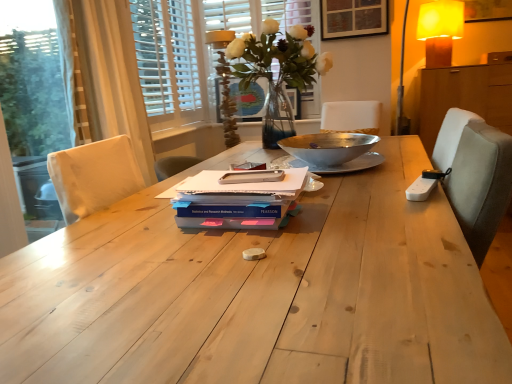
This screenshot has width=512, height=384. I want to click on metallic silver bowl at center, so click(x=328, y=147).

Measure the distance between matte glass vase at upper center, arranged as the first table lamp when viewed from the left, and camera.

matte glass vase at upper center, arranged as the first table lamp when viewed from the left, is 8.73 feet away from camera.

Describe the element at coordinates (225, 84) in the screenshot. I see `matte glass vase at upper center, positioned as the 1th table lamp in bottom-to-top order` at that location.

The width and height of the screenshot is (512, 384). Describe the element at coordinates (170, 60) in the screenshot. I see `clear glass vase at upper center, the 1th bay window viewed from the right` at that location.

Where is `pearlescent paper at center, the 2th paperback book from the top`? This screenshot has height=384, width=512. pearlescent paper at center, the 2th paperback book from the top is located at coordinates (237, 200).

Locate an element on the screen. The height and width of the screenshot is (384, 512). translucent glass vase at center is located at coordinates (279, 72).

Can you confirm if white wooden blinds at upper left, the first bay window in the left-to-right sequence, is shorter than metallic silver bowl at center?

No.

Where is `the 1st bay window behind the metallic silver bowl at center, counting from the anchor's position`? The width and height of the screenshot is (512, 384). the 1st bay window behind the metallic silver bowl at center, counting from the anchor's position is located at coordinates (168, 62).

Considering the relative positions of white wooden blinds at upper left, which is the 2th bay window in right-to-left order, and metallic silver bowl at center in the image provided, is white wooden blinds at upper left, which is the 2th bay window in right-to-left order, to the left of metallic silver bowl at center from the viewer's perspective?

Correct, you'll find white wooden blinds at upper left, which is the 2th bay window in right-to-left order, to the left of metallic silver bowl at center.

Can we say white wooden blinds at upper left, which is the 2th bay window in right-to-left order, lies outside metallic silver bowl at center?

Yes.

Is wooden picture frame at upper center further to camera compared to white matte notebook at center, the 3th paperback book positioned from the bottom?

Yes, it is behind white matte notebook at center, the 3th paperback book positioned from the bottom.

Is wooden picture frame at upper center looking in the opposite direction of white matte notebook at center, the 3th paperback book positioned from the bottom?

No.

The width and height of the screenshot is (512, 384). There is a white matte notebook at center, the 3th paperback book positioned from the bottom. Find the location of `picture frame above it (from a real-world perspective)`. picture frame above it (from a real-world perspective) is located at coordinates (353, 18).

From a real-world perspective, is wooden picture frame at upper center positioned over white matte notebook at center, positioned as the 1th paperback book in top-to-bottom order, based on gravity?

Yes.

Which table lamp is the 2nd one when counting from the back of the blue matte paperback book at center, which appears as the first paperback book when ordered from the bottom? Please provide its 2D coordinates.

[(440, 30)]

Considering the positions of points (450, 45) and (268, 210), is point (450, 45) closer to camera compared to point (268, 210)?

That is False.

Looking at this image, are yellow fabric lampshade at upper right, the 2th table lamp positioned from the left, and blue matte paperback book at center, the third paperback book viewed from the top, far apart?

That's right, there is a large distance between yellow fabric lampshade at upper right, the 2th table lamp positioned from the left, and blue matte paperback book at center, the third paperback book viewed from the top.

Who is shorter, natural wood table at center or white fabric curtain at left?

natural wood table at center.

Considering the points (77, 338) and (120, 130), which point is in front, point (77, 338) or point (120, 130)?

The point (77, 338) is closer to the camera.

Could you tell me if natural wood table at center is facing white fabric curtain at left?

No.

From the image's perspective, who appears lower, natural wood table at center or white fabric curtain at left?

natural wood table at center.

Is white matte notebook at center, positioned as the 1th paperback book in top-to-bottom order, far away from translucent glass vase at center?

Indeed, white matte notebook at center, positioned as the 1th paperback book in top-to-bottom order, is not near translucent glass vase at center.

From their relative heights in the image, would you say white matte notebook at center, the 3th paperback book positioned from the bottom, is taller or shorter than translucent glass vase at center?

In the image, white matte notebook at center, the 3th paperback book positioned from the bottom, appears to be shorter than translucent glass vase at center.

In the scene shown: Choose the correct answer: Is white matte notebook at center, positioned as the 1th paperback book in top-to-bottom order, inside translucent glass vase at center or outside it?

white matte notebook at center, positioned as the 1th paperback book in top-to-bottom order, is spatially situated outside translucent glass vase at center.

Locate an element on the screen. The image size is (512, 384). the 1st paperback book to the left of the translucent glass vase at center, counting from the anchor's position is located at coordinates (245, 183).

Between point (199, 185) and point (242, 11), which one is positioned behind?

Point (242, 11)

Considering the relative sizes of white matte notebook at center, positioned as the 1th paperback book in top-to-bottom order, and clear glass vase at upper center, the 1th bay window viewed from the right, in the image provided, is white matte notebook at center, positioned as the 1th paperback book in top-to-bottom order, taller than clear glass vase at upper center, the 1th bay window viewed from the right,?

No, white matte notebook at center, positioned as the 1th paperback book in top-to-bottom order, is not taller than clear glass vase at upper center, the 1th bay window viewed from the right.

Is white matte notebook at center, the 3th paperback book positioned from the bottom, wider or thinner than clear glass vase at upper center, placed as the 2th bay window when sorted from left to right?

white matte notebook at center, the 3th paperback book positioned from the bottom, is wider than clear glass vase at upper center, placed as the 2th bay window when sorted from left to right.

Considering the relative positions of white matte notebook at center, the 3th paperback book positioned from the bottom, and clear glass vase at upper center, the 1th bay window viewed from the right, in the image provided, is white matte notebook at center, the 3th paperback book positioned from the bottom, to the left of clear glass vase at upper center, the 1th bay window viewed from the right, from the viewer's perspective?

Indeed, white matte notebook at center, the 3th paperback book positioned from the bottom, is positioned on the left side of clear glass vase at upper center, the 1th bay window viewed from the right.

Is the depth of natural wood table at center less than that of translucent glass vase at center?

Yes, it is in front of translucent glass vase at center.

Is natural wood table at center turned away from translucent glass vase at center?

No.

Does natural wood table at center appear on the right side of translucent glass vase at center?

Yes.

Looking at the image, does natural wood table at center seem bigger or smaller compared to translucent glass vase at center?

Considering their sizes, natural wood table at center takes up more space than translucent glass vase at center.

The width and height of the screenshot is (512, 384). I want to click on bowl below the white wooden blinds at upper left, the first bay window in the left-to-right sequence (from a real-world perspective), so click(x=328, y=147).

Locate an element on the screen. This screenshot has width=512, height=384. the 1st paperback book to the left when counting from the wooden picture frame at upper center is located at coordinates (245, 183).

Which object lies further to the anchor point white matte notebook at center, the 3th paperback book positioned from the bottom, pearlescent paper at center, the second paperback book positioned from the bottom, or matte glass vase at upper center, the first table lamp from the front?

The object further to white matte notebook at center, the 3th paperback book positioned from the bottom, is matte glass vase at upper center, the first table lamp from the front.

Estimate the real-world distances between objects in this image. Which object is closer to matte glass vase at upper center, the first table lamp from the front, white fabric curtain at left or white matte notebook at center, the 3th paperback book positioned from the bottom?

white fabric curtain at left is closer to matte glass vase at upper center, the first table lamp from the front.

Considering their positions, is yellow fabric lampshade at upper right, which is counted as the first table lamp, starting from the right, positioned closer to matte glass vase at upper center, arranged as the 2th table lamp when viewed from the right, than white wooden blinds at upper left, which is the 2th bay window in right-to-left order?

Based on the image, white wooden blinds at upper left, which is the 2th bay window in right-to-left order, appears to be nearer to matte glass vase at upper center, arranged as the 2th table lamp when viewed from the right.

Considering their positions, is natural wood table at center positioned closer to white wooden blinds at upper left, the first bay window in the left-to-right sequence, than white fabric curtain at left?

The object closer to white wooden blinds at upper left, the first bay window in the left-to-right sequence, is white fabric curtain at left.

From the image, which object appears to be farther from white fabric curtain at left, translucent glass vase at center or matte glass vase at upper center, acting as the 2th table lamp starting from the top?

matte glass vase at upper center, acting as the 2th table lamp starting from the top, lies further to white fabric curtain at left than the other object.

When comparing their distances from white fabric curtain at left, does white wooden blinds at upper left, the first bay window in the left-to-right sequence, or natural wood table at center seem closer?

The object closer to white fabric curtain at left is white wooden blinds at upper left, the first bay window in the left-to-right sequence.

Which object lies further to the anchor point wooden picture frame at upper center, matte glass vase at upper center, positioned as the 1th table lamp in bottom-to-top order, or white wooden blinds at upper left, the first bay window in the left-to-right sequence?

Among the two, white wooden blinds at upper left, the first bay window in the left-to-right sequence, is located further to wooden picture frame at upper center.

From the image, which object appears to be farther from translucent glass vase at center, white wooden blinds at upper left, which is the 2th bay window in right-to-left order, or white fabric curtain at left?

The object further to translucent glass vase at center is white wooden blinds at upper left, which is the 2th bay window in right-to-left order.

The height and width of the screenshot is (384, 512). Identify the location of curtain between white matte notebook at center, positioned as the 1th paperback book in top-to-bottom order, and matte glass vase at upper center, acting as the 2th table lamp starting from the top, in the front-back direction. (103, 76).

Locate an element on the screen. Image resolution: width=512 pixels, height=384 pixels. floral arrangement situated between clear glass vase at upper center, placed as the 2th bay window when sorted from left to right, and wooden cabinet at right from left to right is located at coordinates (279, 72).

Locate an element on the screen. bay window located between natural wood table at center and matte glass vase at upper center, arranged as the 2th table lamp when viewed from the right, in the depth direction is located at coordinates (168, 62).

Locate an element on the screen. The width and height of the screenshot is (512, 384). picture frame between matte glass vase at upper center, positioned as the 1th table lamp in bottom-to-top order, and yellow fabric lampshade at upper right, arranged as the 1th table lamp when viewed from the back, in the horizontal direction is located at coordinates (353, 18).